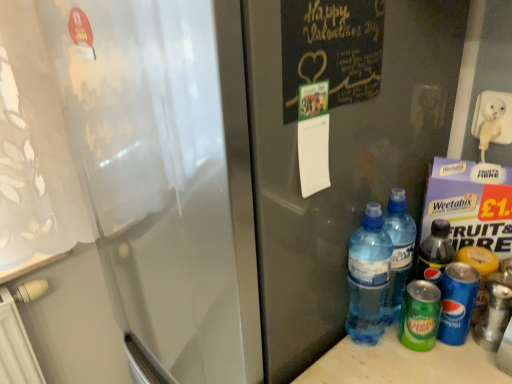
Question: Is black chalkboard at upper right far away from translucent plastic water bottles at lower right, the third bottle in the right-to-left sequence?

Choices:
 (A) no
 (B) yes

Answer: (A)

Question: Is black chalkboard at upper right smaller than translucent plastic water bottles at lower right, the first bottle when ordered from left to right?

Choices:
 (A) yes
 (B) no

Answer: (A)

Question: Considering the relative positions of black chalkboard at upper right and translucent plastic water bottles at lower right, the first bottle when ordered from left to right, in the image provided, is black chalkboard at upper right in front of translucent plastic water bottles at lower right, the first bottle when ordered from left to right,?

Choices:
 (A) no
 (B) yes

Answer: (B)

Question: Is black chalkboard at upper right taller than translucent plastic water bottles at lower right, the third bottle in the right-to-left sequence?

Choices:
 (A) no
 (B) yes

Answer: (A)

Question: Can you see black chalkboard at upper right touching translucent plastic water bottles at lower right, the third bottle in the right-to-left sequence?

Choices:
 (A) yes
 (B) no

Answer: (B)

Question: Is black chalkboard at upper right oriented away from translucent plastic water bottles at lower right, the third bottle in the right-to-left sequence?

Choices:
 (A) yes
 (B) no

Answer: (B)

Question: From a real-world perspective, does green matte can at lower right, the second bottle in the left-to-right sequence, sit lower than black chalkboard at upper right?

Choices:
 (A) yes
 (B) no

Answer: (A)

Question: Can you confirm if green matte can at lower right, the second bottle in the left-to-right sequence, is taller than black chalkboard at upper right?

Choices:
 (A) yes
 (B) no

Answer: (B)

Question: Is green matte can at lower right, the second bottle in the left-to-right sequence, thinner than black chalkboard at upper right?

Choices:
 (A) no
 (B) yes

Answer: (A)

Question: Is green matte can at lower right, the 2th bottle in the right-to-left sequence, not near black chalkboard at upper right?

Choices:
 (A) no
 (B) yes

Answer: (A)

Question: Is green matte can at lower right, the 2th bottle in the right-to-left sequence, at the left side of black chalkboard at upper right?

Choices:
 (A) yes
 (B) no

Answer: (B)

Question: From the image's perspective, does green matte can at lower right, the second bottle in the left-to-right sequence, appear higher than black chalkboard at upper right?

Choices:
 (A) yes
 (B) no

Answer: (B)

Question: Is green matte can at lower right, the 2th bottle in the right-to-left sequence, thinner than translucent plastic water bottles at lower right, the third bottle in the right-to-left sequence?

Choices:
 (A) no
 (B) yes

Answer: (B)